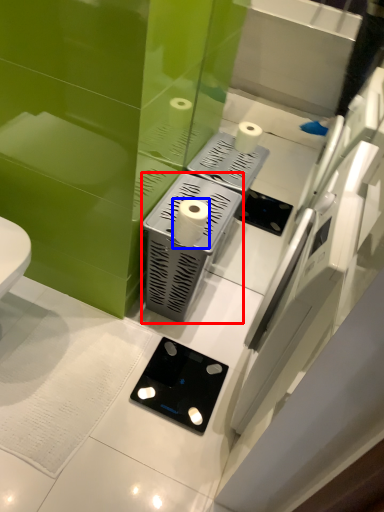
Question: Which object appears closest to the camera in this image, appliance (highlighted by a red box) or toilet paper (highlighted by a blue box)?

Choices:
 (A) appliance
 (B) toilet paper

Answer: (B)